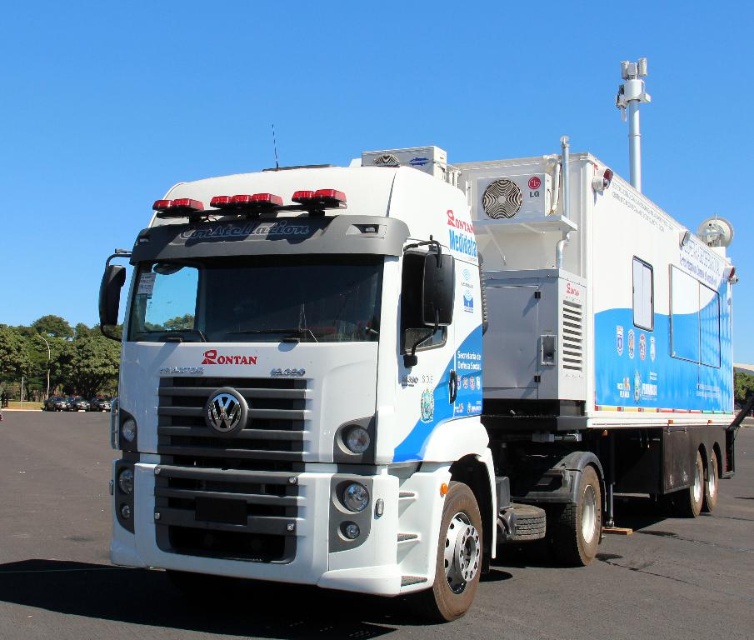
Question: Is white glossy trailer truck at center wider than white glossy truck at center?

Choices:
 (A) yes
 (B) no

Answer: (B)

Question: Is white glossy trailer truck at center above white glossy truck at center?

Choices:
 (A) no
 (B) yes

Answer: (B)

Question: Can you confirm if white glossy trailer truck at center is thinner than white glossy truck at center?

Choices:
 (A) yes
 (B) no

Answer: (A)

Question: Among these points, which one is farthest from the camera?

Choices:
 (A) (80, 598)
 (B) (550, 397)

Answer: (B)